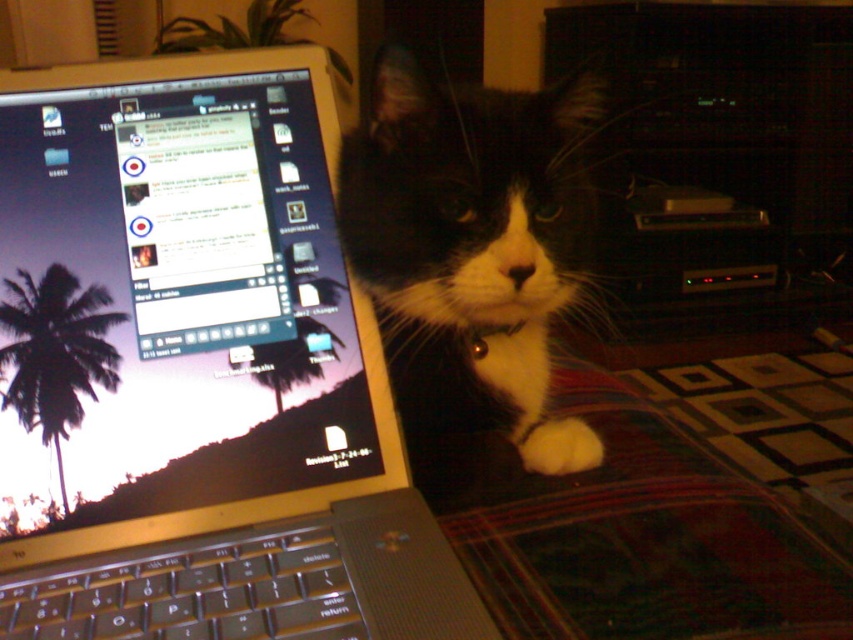
Is black fur cat at center shorter than black plastic keyboard at lower left?

No, black fur cat at center is not shorter than black plastic keyboard at lower left.

Between black fur cat at center and black plastic keyboard at lower left, which one appears on the right side from the viewer's perspective?

From the viewer's perspective, black fur cat at center appears more on the right side.

Measure the distance between point (405, 92) and camera.

Point (405, 92) and camera are 18.48 inches apart from each other.

Identify the location of black fur cat at center. (468, 241).

Is silver metallic laptop at center shorter than black fur cat at center?

In fact, silver metallic laptop at center may be taller than black fur cat at center.

Consider the image. Between silver metallic laptop at center and black fur cat at center, which one appears on the right side from the viewer's perspective?

black fur cat at center

Between point (311, 291) and point (520, 348), which one is positioned behind?

The point (520, 348) is more distant.

This screenshot has height=640, width=853. I want to click on silver metallic laptop at center, so click(x=196, y=369).

Between black fur cat at center and white fluffy paw at lower right, which one has less height?

With less height is white fluffy paw at lower right.

Does black fur cat at center have a greater width compared to white fluffy paw at lower right?

Correct, the width of black fur cat at center exceeds that of white fluffy paw at lower right.

The width and height of the screenshot is (853, 640). What do you see at coordinates (468, 241) in the screenshot?
I see `black fur cat at center` at bounding box center [468, 241].

You are a GUI agent. You are given a task and a screenshot of the screen. Output one action in this format:
    pyautogui.click(x=<x>, y=<y>)
    Task: Click on the black fur cat at center
    
    Given the screenshot: What is the action you would take?
    pyautogui.click(x=468, y=241)